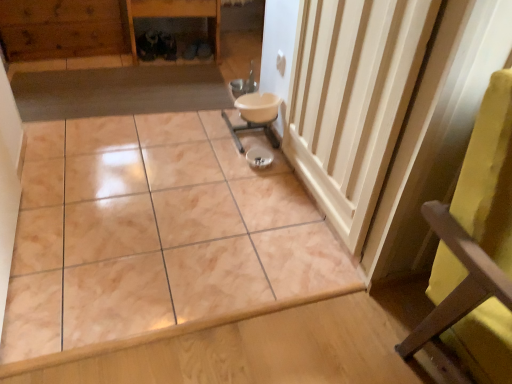
You are a GUI agent. You are given a task and a screenshot of the screen. Output one action in this format:
    pyautogui.click(x=<x>, y=<y>)
    Task: Click on the vacant space situated on the left part of white wood radiator at center right
    This screenshot has height=384, width=512.
    Given the screenshot: What is the action you would take?
    pyautogui.click(x=206, y=185)